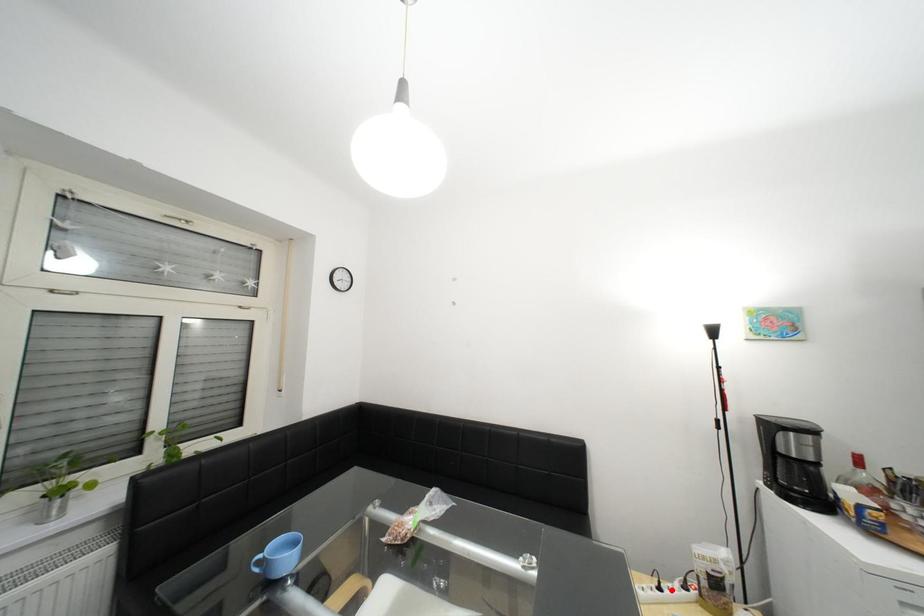
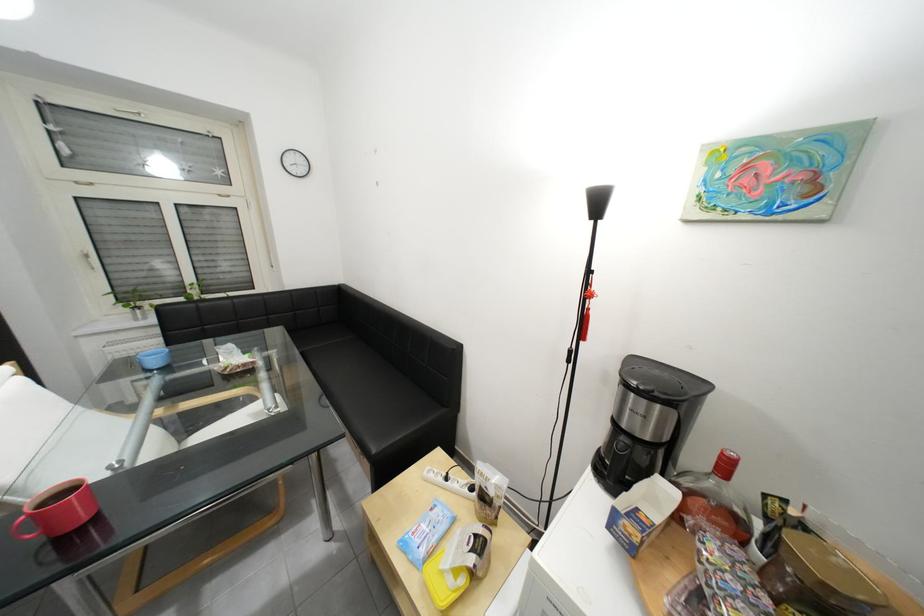
The point at the highlighted location is marked in the first image. Where is the corresponding point in the second image?

(457, 479)